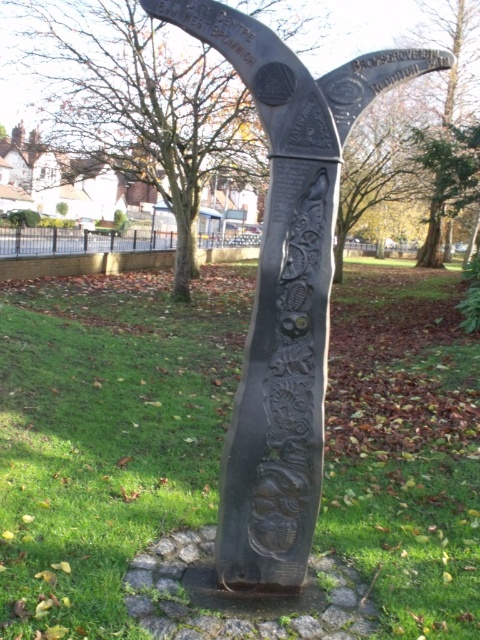
You are a gardener who needs to mow the lawn around the black polished stone sculpture at center. From your current position at the edge of the green grass at center, which direction should you move to reach the sculpture first?

The green grass at center is positioned on the left side of the black polished stone sculpture at center, so you should move to your right to reach the sculpture first.

You are a gardener planning to mow the lawn around the black polished stone sculpture at center. You need to know if the green grass at center is wider than the sculpture to ensure your lawnmower can navigate around it. Can you confirm?

The green grass at center is wider than the black polished stone sculpture at center, so the lawnmower can navigate around it easily.

You are a gardener who needs to mow the lawn around the black polished stone sculpture at center. Since the green grass at center is shorter than the sculpture, will you be able to mow the grass without hitting the sculpture?

The green grass at center has a lesser height compared to the black polished stone sculpture at center, so yes, you can mow the grass without hitting the sculpture as it is shorter than the sculpture.